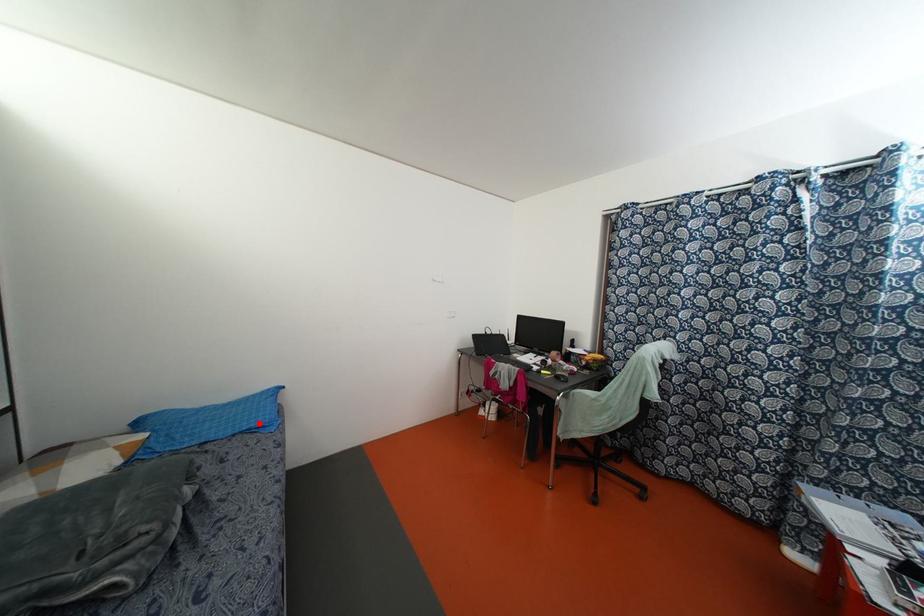
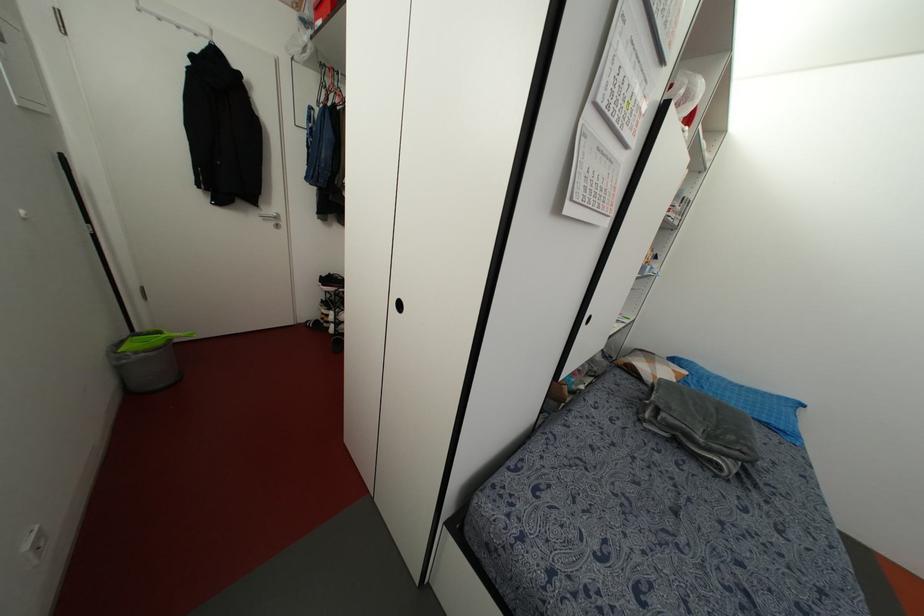
The point at the highlighted location is marked in the first image. Where is the corresponding point in the second image?

(782, 427)